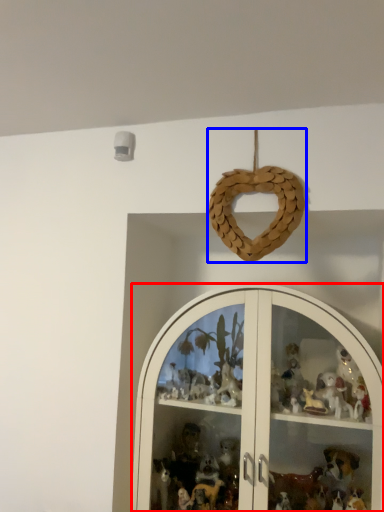
Question: Which object is closer to the camera taking this photo, shelf (highlighted by a red box) or toy (highlighted by a blue box)?

Choices:
 (A) shelf
 (B) toy

Answer: (A)